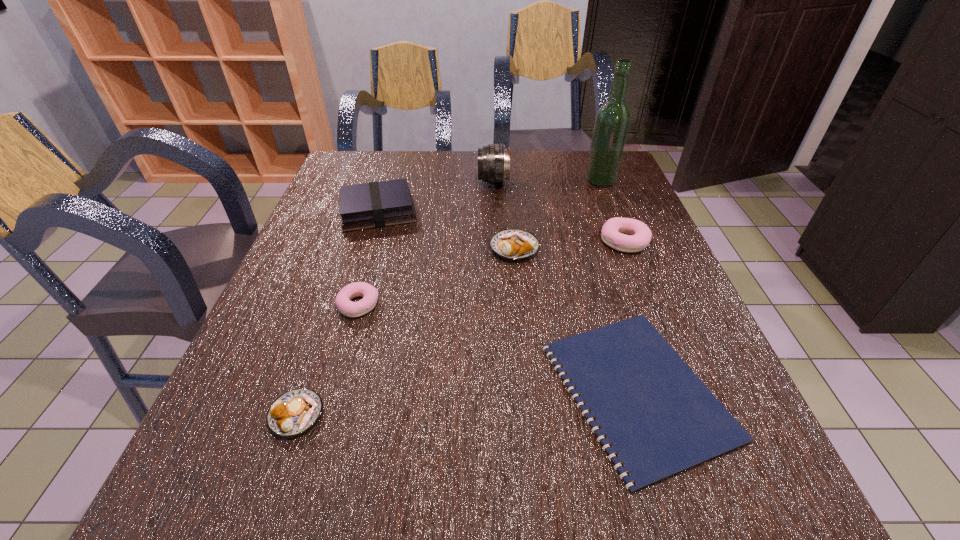
The height and width of the screenshot is (540, 960). Find the location of `vacant space located on the front of the bigger pink pastry`. vacant space located on the front of the bigger pink pastry is located at coordinates click(683, 389).

This screenshot has width=960, height=540. Identify the location of vacant space positioned on the left of the bigger brown pastry. (374, 248).

Find the location of a particular element. free space located 0.160m on the right of the third farthest pastry is located at coordinates (455, 305).

Identify the location of vacant point located 0.400m on the right of the nearer brown pastry. (562, 415).

Find the location of `vacant region located 0.390m on the left of the notepad`. vacant region located 0.390m on the left of the notepad is located at coordinates tap(325, 391).

Where is `liquor located at the far edge`? This screenshot has width=960, height=540. liquor located at the far edge is located at coordinates pyautogui.click(x=612, y=121).

This screenshot has width=960, height=540. In order to click on telephoto lens situated at the far edge in this screenshot , I will do `click(493, 160)`.

Identify the location of object located in the near edge section of the desktop. Image resolution: width=960 pixels, height=540 pixels. (660, 419).

Where is `book that is at the left edge`? book that is at the left edge is located at coordinates (369, 205).

I want to click on liquor located at the right edge, so click(612, 121).